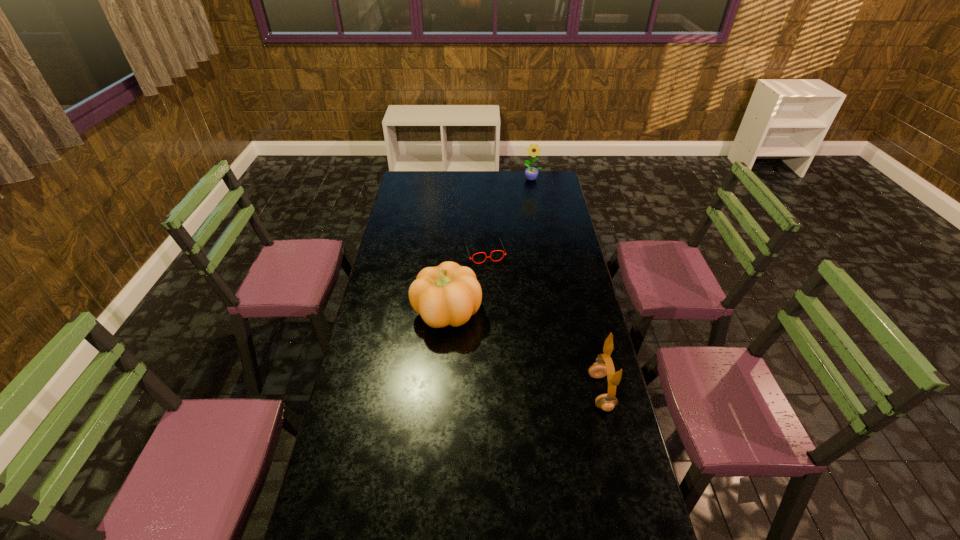
What are the coordinates of `free area in between the spectacles and the rightmost object` in the screenshot? It's located at pyautogui.click(x=542, y=322).

Identify the location of blank region between the farthest object and the shortest object. This screenshot has width=960, height=540. (509, 215).

Locate an element on the screen. Image resolution: width=960 pixels, height=540 pixels. vacant space in between the spectacles and the farthest object is located at coordinates (509, 215).

The image size is (960, 540). I want to click on the third closest object to the second farthest object, so click(x=606, y=402).

Locate an element on the screen. Image resolution: width=960 pixels, height=540 pixels. the closest object relative to the rightmost object is located at coordinates (449, 294).

The height and width of the screenshot is (540, 960). Find the location of `free space in the image that satisfies the following two spatial constraints: 1. on the front side of the second farthest object; 2. on the front-facing side of the earphone`. free space in the image that satisfies the following two spatial constraints: 1. on the front side of the second farthest object; 2. on the front-facing side of the earphone is located at coordinates (487, 392).

Identify the location of free region that satisfies the following two spatial constraints: 1. on the front side of the farthest object; 2. on the front-facing side of the nearest object. (569, 392).

You are a GUI agent. You are given a task and a screenshot of the screen. Output one action in this format:
    pyautogui.click(x=<x>, y=<y>)
    Task: Click on the vacant region that satisfies the following two spatial constraints: 1. on the back side of the sunflower; 2. on the right side of the pumpkin
    
    Given the screenshot: What is the action you would take?
    pyautogui.click(x=457, y=179)

The width and height of the screenshot is (960, 540). What are the coordinates of `blank space that satisfies the following two spatial constraints: 1. on the back side of the second nearest object; 2. on the left side of the second farthest object` in the screenshot? It's located at (451, 252).